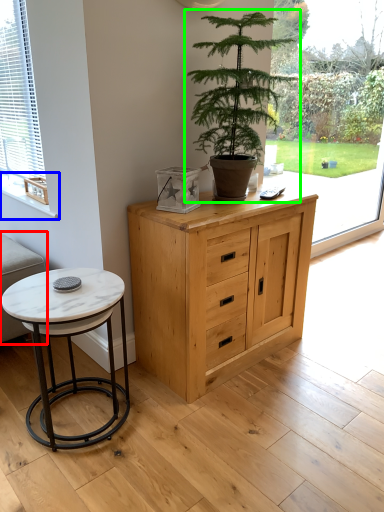
Question: Which is nearer to the couch (highlighted by a red box)? window sill (highlighted by a blue box) or houseplant (highlighted by a green box).

Choices:
 (A) window sill
 (B) houseplant

Answer: (A)